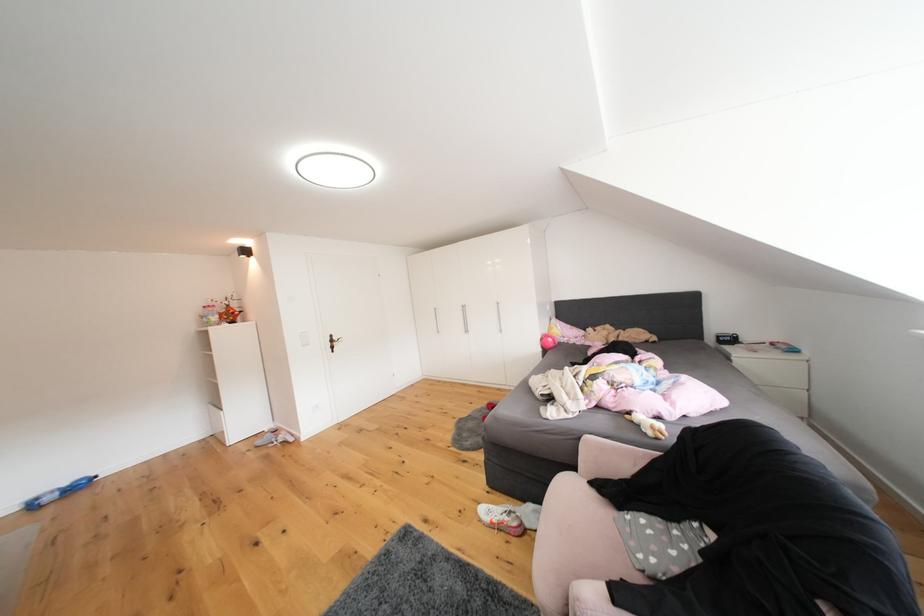
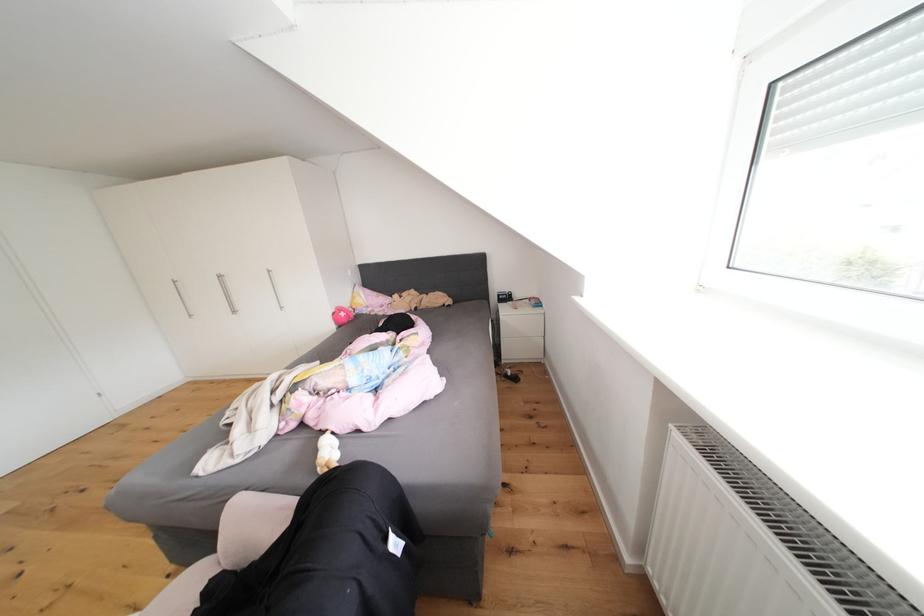
Locate, in the second image, the point that corresponds to [551,342] in the first image.

(343, 318)